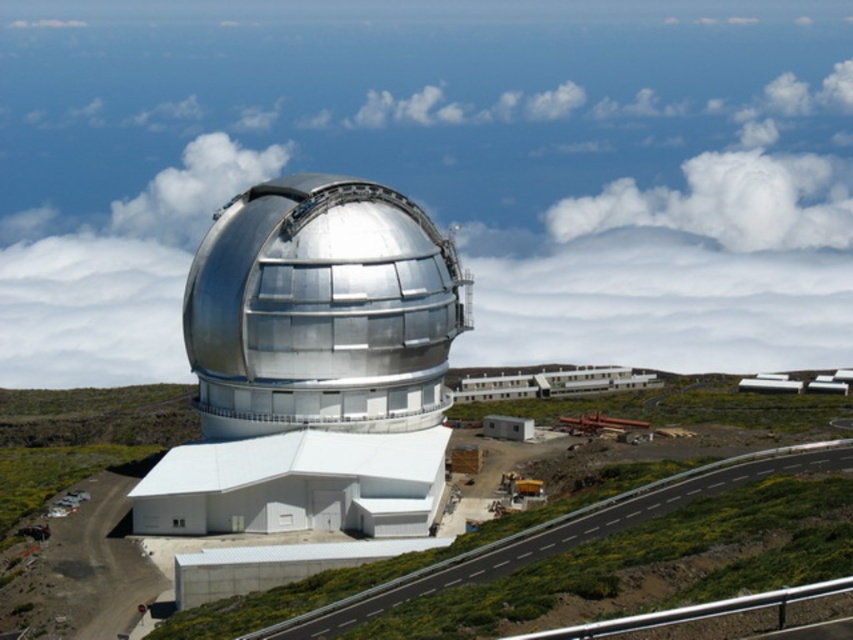
Measure the distance between point (223, 493) and camera.

Point (223, 493) and camera are 107.07 meters apart from each other.

Does polished silver observatory at center appear under white fluffy cloud at upper center?

Correct, polished silver observatory at center is located below white fluffy cloud at upper center.

Which is behind, point (390, 244) or point (670, 211)?

Point (670, 211)

At what (x,y) coordinates should I click in order to perform the action: click on polished silver observatory at center. Please return your answer as a coordinate pair (x, y). This screenshot has width=853, height=640. Looking at the image, I should click on (312, 365).

Which is above, metallic silver dome at center or white fluffy cloud at upper center?

white fluffy cloud at upper center is above.

Is metallic silver dome at center above white fluffy cloud at upper center?

Incorrect, metallic silver dome at center is not positioned above white fluffy cloud at upper center.

Measure the distance between point (57, 289) and camera.

They are 333.75 meters apart.

You are a GUI agent. You are given a task and a screenshot of the screen. Output one action in this format:
    pyautogui.click(x=<x>, y=<y>)
    Task: Click on the metallic silver dome at center
    
    Given the screenshot: What is the action you would take?
    pyautogui.click(x=676, y=268)

Who is more forward, (13, 352) or (437, 464)?

Point (437, 464)

Image resolution: width=853 pixels, height=640 pixels. I want to click on metallic silver dome at center, so click(x=676, y=268).

In the scene shown: Who is more distant from viewer, (805, 193) or (242, 458)?

The point (805, 193) is more distant.

I want to click on metallic silver dome at center, so click(676, 268).